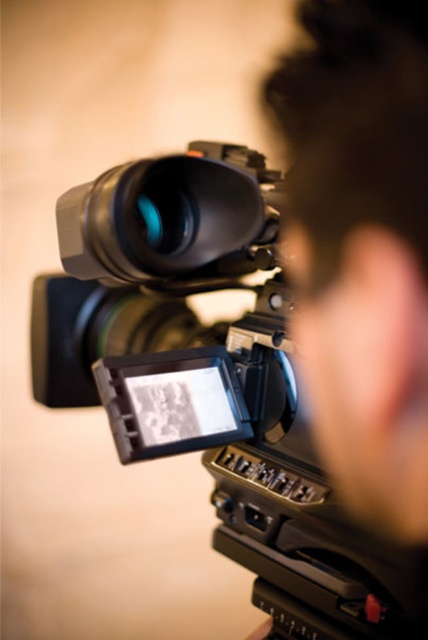
Question: Which object is closer to the camera taking this photo?

Choices:
 (A) matte black lens at center
 (B) black plastic camera at center

Answer: (B)

Question: Does black plastic camera at center have a greater width compared to matte black lens at center?

Choices:
 (A) yes
 (B) no

Answer: (A)

Question: Is black plastic camera at center to the left of matte black lens at center from the viewer's perspective?

Choices:
 (A) no
 (B) yes

Answer: (B)

Question: Is black plastic camera at center bigger than matte black lens at center?

Choices:
 (A) yes
 (B) no

Answer: (A)

Question: Which object appears farthest from the camera in this image?

Choices:
 (A) black plastic camera at center
 (B) matte black lens at center

Answer: (B)